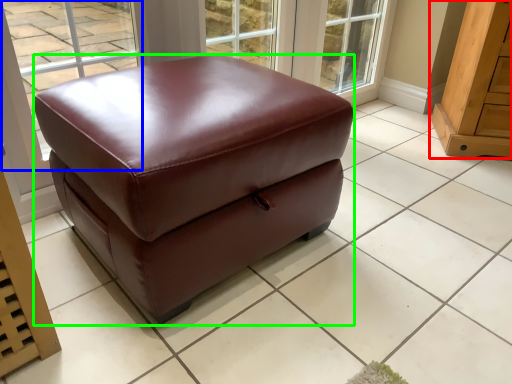
Question: Based on their relative distances, which object is nearer to furniture (highlighted by a red box)? Choose from window (highlighted by a blue box) and furniture (highlighted by a green box).

Choices:
 (A) window
 (B) furniture

Answer: (B)